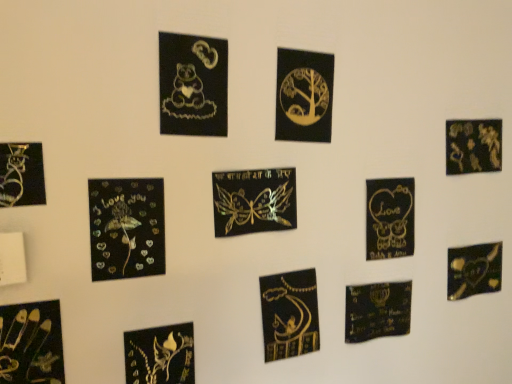
Question: Does matte black heart at lower center, the 1th embroidery from the right, touch metallic gold heart at bottom right?

Choices:
 (A) no
 (B) yes

Answer: (A)

Question: Can you confirm if matte black heart at lower center, the 1th embroidery from the right, is positioned to the right of metallic gold heart at bottom right?

Choices:
 (A) yes
 (B) no

Answer: (B)

Question: Is matte black heart at lower center, the 2th embroidery when ordered from front to back, positioned before metallic gold heart at bottom right?

Choices:
 (A) yes
 (B) no

Answer: (A)

Question: Is matte black heart at lower center, the 1th embroidery from the right, turned away from metallic gold heart at bottom right?

Choices:
 (A) yes
 (B) no

Answer: (B)

Question: Is matte black heart at lower center, the 2th embroidery when ordered from front to back, located outside metallic gold heart at bottom right?

Choices:
 (A) yes
 (B) no

Answer: (A)

Question: Does matte black heart at lower center, the 1th embroidery from the back, have a smaller size compared to metallic gold heart at bottom right?

Choices:
 (A) yes
 (B) no

Answer: (A)

Question: Are white matte switch at lower left and metallic gold floral design at upper right, which is the 9th picture frame in left-to-right order, beside each other?

Choices:
 (A) yes
 (B) no

Answer: (B)

Question: Is white matte switch at lower left positioned behind metallic gold floral design at upper right, the 1th picture frame when ordered from right to left?

Choices:
 (A) no
 (B) yes

Answer: (A)

Question: Is white matte switch at lower left located outside metallic gold floral design at upper right, which is the 9th picture frame in left-to-right order?

Choices:
 (A) yes
 (B) no

Answer: (A)

Question: Can you confirm if white matte switch at lower left is positioned to the left of metallic gold floral design at upper right, the 1th picture frame when ordered from right to left?

Choices:
 (A) yes
 (B) no

Answer: (A)

Question: Does white matte switch at lower left have a smaller size compared to metallic gold floral design at upper right, which is the 9th picture frame in left-to-right order?

Choices:
 (A) no
 (B) yes

Answer: (B)

Question: Is white matte switch at lower left taller than metallic gold floral design at upper right, the 1th picture frame when ordered from right to left?

Choices:
 (A) no
 (B) yes

Answer: (A)

Question: Considering the relative sizes of metallic gold butterfly at lower left, the fourth picture frame when ordered from left to right, and gold metallic calligraphy at center, the second embroidery from the back, in the image provided, is metallic gold butterfly at lower left, the fourth picture frame when ordered from left to right, bigger than gold metallic calligraphy at center, the second embroidery from the back,?

Choices:
 (A) no
 (B) yes

Answer: (A)